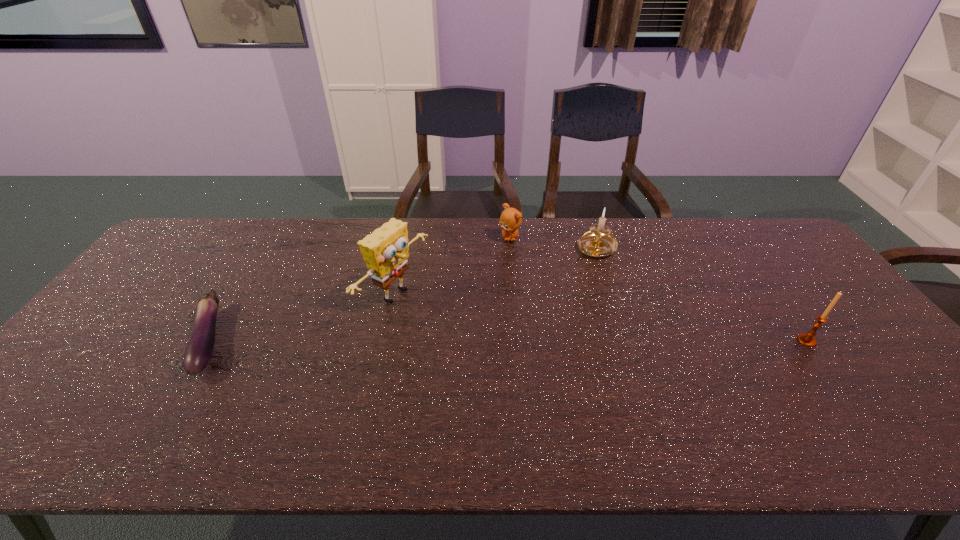
The width and height of the screenshot is (960, 540). What are the coordinates of `free region at the far right corner` in the screenshot? It's located at (756, 245).

At what (x,y) coordinates should I click in order to perform the action: click on free space between the tallest object and the shortest object. Please return your answer as a coordinate pair (x, y). The image size is (960, 540). Looking at the image, I should click on (302, 318).

At what (x,y) coordinates should I click in order to perform the action: click on free space between the third object from right to left and the sponge. Please return your answer as a coordinate pair (x, y). Looking at the image, I should click on (452, 266).

The image size is (960, 540). In order to click on free space between the third tallest object and the shortest object in this screenshot , I will do `click(403, 294)`.

Locate an element on the screen. This screenshot has width=960, height=540. free space between the eggplant and the fourth object from left to right is located at coordinates (403, 294).

Find the location of `free space between the second shortest object and the rightmost object`. free space between the second shortest object and the rightmost object is located at coordinates (659, 289).

Image resolution: width=960 pixels, height=540 pixels. I want to click on free space that is in between the fourth object from right to left and the fourth tallest object, so click(452, 266).

Locate an element on the screen. Image resolution: width=960 pixels, height=540 pixels. vacant area that lies between the third object from left to right and the tallest object is located at coordinates (452, 266).

Locate an element on the screen. This screenshot has width=960, height=540. free spot between the fourth object from left to right and the teddy bear is located at coordinates (553, 242).

Image resolution: width=960 pixels, height=540 pixels. Find the location of `vacant region between the shorter candle holder and the fourth tallest object`. vacant region between the shorter candle holder and the fourth tallest object is located at coordinates (553, 242).